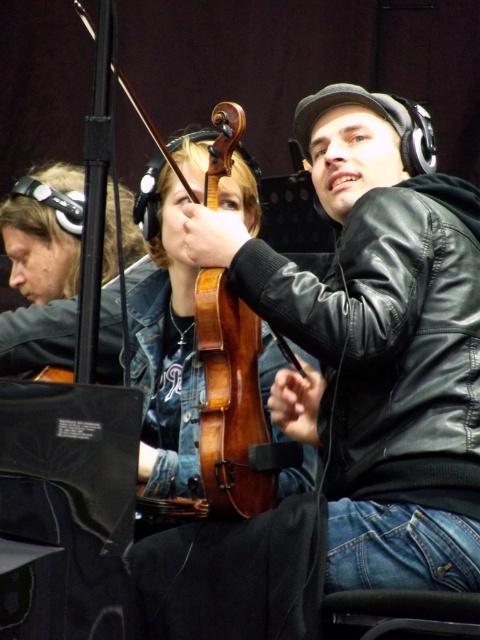
Is black leather jacket at center positioned at the back of wooden violin at center?

That is False.

Between black leather jacket at center and wooden violin at center, which one has less height?

Standing shorter between the two is wooden violin at center.

Does point (441, 180) come in front of point (240, 348)?

That is False.

Where is `black leather jacket at center`? The image size is (480, 640). black leather jacket at center is located at coordinates (389, 340).